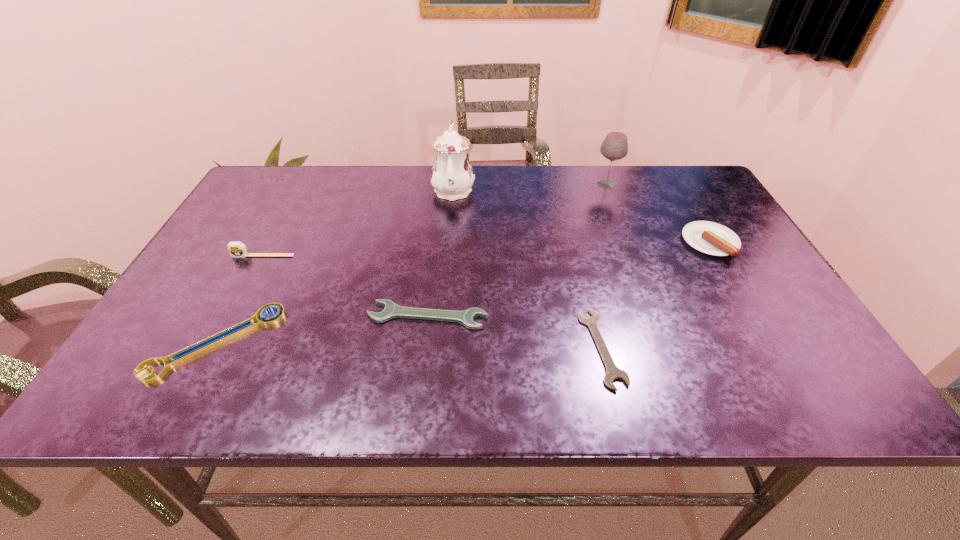
Find the location of `vacant point located on the front of the second tallest object`. vacant point located on the front of the second tallest object is located at coordinates click(637, 265).

Find the location of a particular element. Image resolution: width=960 pixels, height=540 pixels. free region located at the front of the tape measure with the tape extended is located at coordinates (232, 313).

Find the location of `vacant space situated on the left of the sausage`. vacant space situated on the left of the sausage is located at coordinates (619, 242).

This screenshot has height=540, width=960. I want to click on vacant area situated on the back of the second wrench from left to right, so click(x=440, y=210).

The image size is (960, 540). Find the location of `vacant space located on the back of the leftmost wrench`. vacant space located on the back of the leftmost wrench is located at coordinates (276, 230).

This screenshot has width=960, height=540. Identify the location of vacant position located on the back of the rightmost wrench. (569, 215).

The height and width of the screenshot is (540, 960). Identify the location of chinaware at the far edge. (452, 176).

The width and height of the screenshot is (960, 540). Identify the location of wineglass that is at the far edge. (614, 147).

I want to click on tape measure present at the left edge, so click(236, 249).

Identify the location of wrench located in the left edge section of the desktop. Image resolution: width=960 pixels, height=540 pixels. (228, 334).